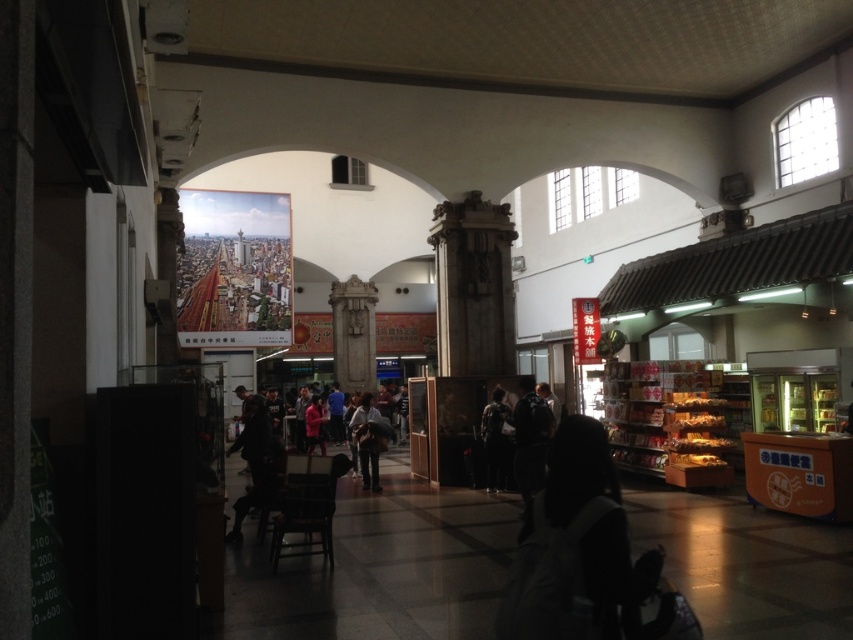
Does dark gray pants at center have a larger size compared to matte red jacket at center?

Indeed, dark gray pants at center has a larger size compared to matte red jacket at center.

Is dark gray pants at center to the left of matte red jacket at center from the viewer's perspective?

In fact, dark gray pants at center is to the right of matte red jacket at center.

Between point (379, 436) and point (318, 408), which one is positioned in front?

Point (379, 436) is in front.

The height and width of the screenshot is (640, 853). I want to click on dark gray pants at center, so click(x=369, y=440).

Is dark fabric backpack at lower center above dark gray fabric jacket at center?

Yes, dark fabric backpack at lower center is above dark gray fabric jacket at center.

Can you confirm if dark fabric backpack at lower center is bigger than dark gray fabric jacket at center?

No.

Where is `dark fabric backpack at lower center`? dark fabric backpack at lower center is located at coordinates (576, 548).

Does dark fabric backpack at lower center have a smaller size compared to dark blue jacket at center?

Indeed, dark fabric backpack at lower center has a smaller size compared to dark blue jacket at center.

Measure the distance between dark fabric backpack at lower center and dark blue jacket at center.

dark fabric backpack at lower center and dark blue jacket at center are 7.01 meters apart.

Who is more forward, (x=564, y=474) or (x=524, y=474)?

Point (x=564, y=474)

This screenshot has height=640, width=853. In order to click on dark fabric backpack at lower center in this screenshot , I will do `click(576, 548)`.